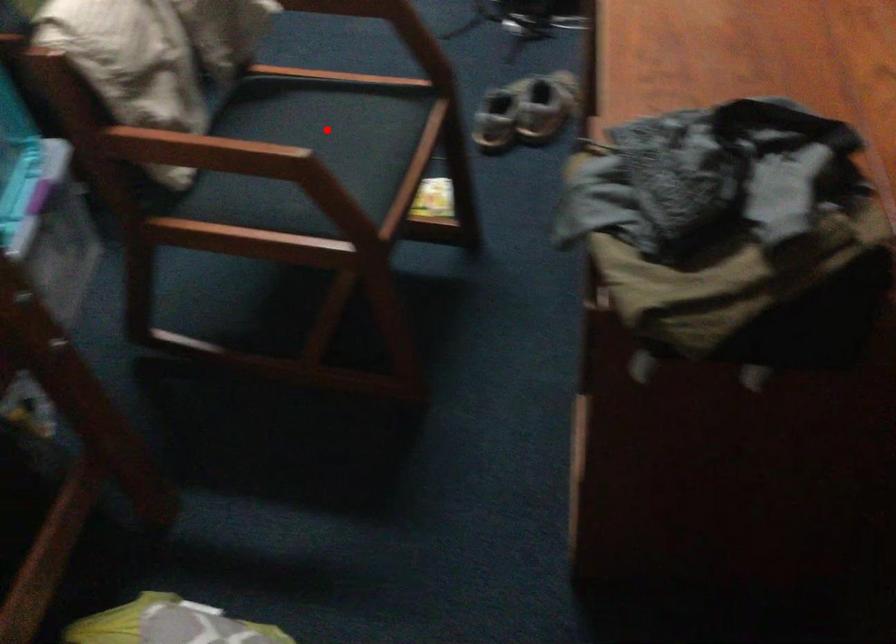
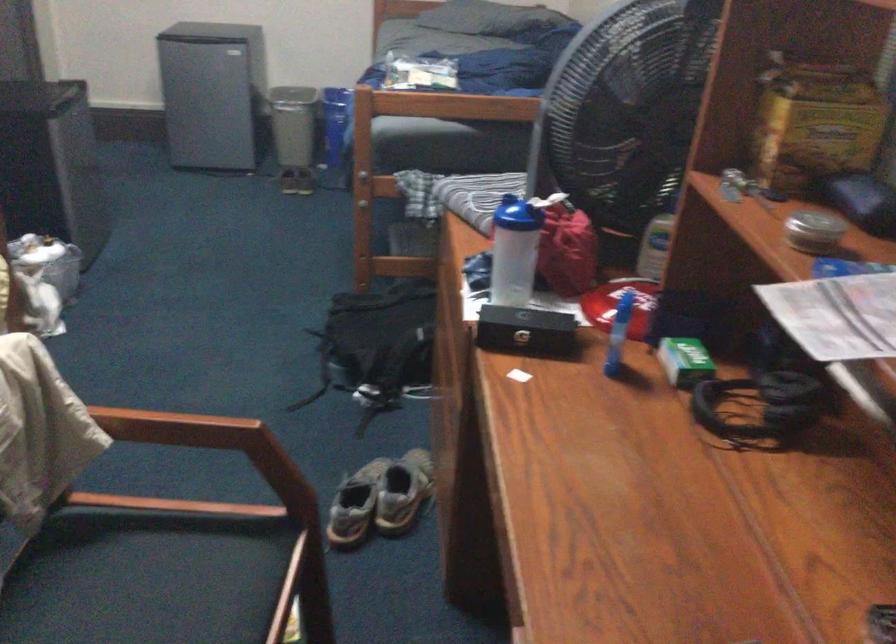
Question: A red point is marked in image1. In image2, is the corresponding 3D point closer to the camera or farther? Reply with the corresponding letter.

Choices:
 (A) The corresponding 3D point is closer.
 (B) The corresponding 3D point is farther.

Answer: (A)